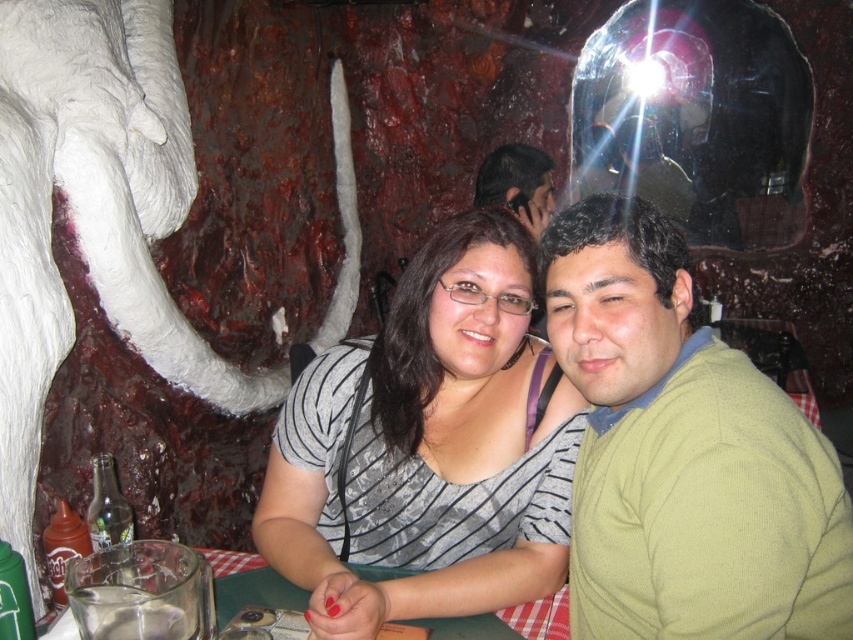
Question: Does gray striped shirt at center have a greater width compared to matte green sweater at center?

Choices:
 (A) no
 (B) yes

Answer: (B)

Question: Among these points, which one is nearest to the camera?

Choices:
 (A) (566, 404)
 (B) (512, 182)

Answer: (A)

Question: Which point is farther to the camera?

Choices:
 (A) (503, 177)
 (B) (618, 433)

Answer: (A)

Question: Which point is closer to the camera taking this photo?

Choices:
 (A) (541, 157)
 (B) (834, 588)
 (C) (463, 225)

Answer: (B)

Question: Can you confirm if green sweater at center is positioned above matte green sweater at center?

Choices:
 (A) no
 (B) yes

Answer: (A)

Question: In this image, where is green sweater at center located relative to matte green sweater at center?

Choices:
 (A) right
 (B) left

Answer: (A)